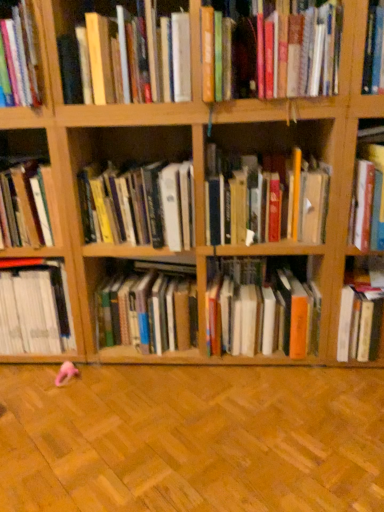
Question: From the image's perspective, is hardcover book at center, the 4th book when ordered from left to right, located above or below orange matte book at center, arranged as the 9th book when viewed from the left?

Choices:
 (A) below
 (B) above

Answer: (B)

Question: Is point (114, 193) positioned closer to the camera than point (301, 323)?

Choices:
 (A) closer
 (B) farther

Answer: (A)

Question: Which object is positioned farthest from the orange matte book at center, arranged as the 9th book when viewed from the left?

Choices:
 (A) hardcover book at center, which appears as the 4th book when viewed from the right
 (B) hardcover book at right, placed as the 1th book when sorted from right to left
 (C) hardcover book at left, the first book viewed from the left
 (D) hardcover book at upper center, which is counted as the seventh book, starting from the left
 (E) hardcover book at upper left, which ranks as the third book in left-to-right order

Answer: (E)

Question: Which of these objects is positioned farthest from the hardcover book at left, the first book viewed from the left?

Choices:
 (A) hardcover book at upper center, which is counted as the seventh book, starting from the left
 (B) hardcover book at right, which is the eleventh book from left to right
 (C) hardcover book at center, the 6th book positioned from the left
 (D) hardcover book at center, which appears as the 4th book when viewed from the right
 (E) white matte book at left, the tenth book positioned from the right

Answer: (B)